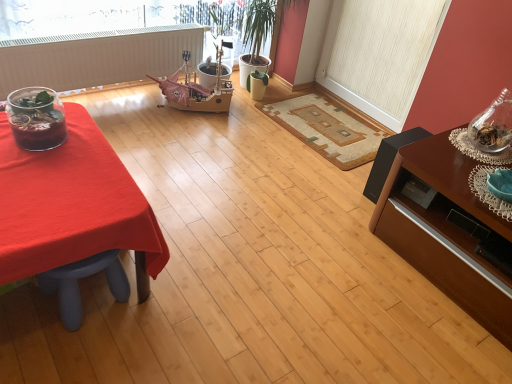
At what (x,y) coordinates should I click in order to perform the action: click on free point above smooth red tablecloth at left (from a real-world perspective). Please return your answer as a coordinate pair (x, y). The width and height of the screenshot is (512, 384). Looking at the image, I should click on tap(58, 175).